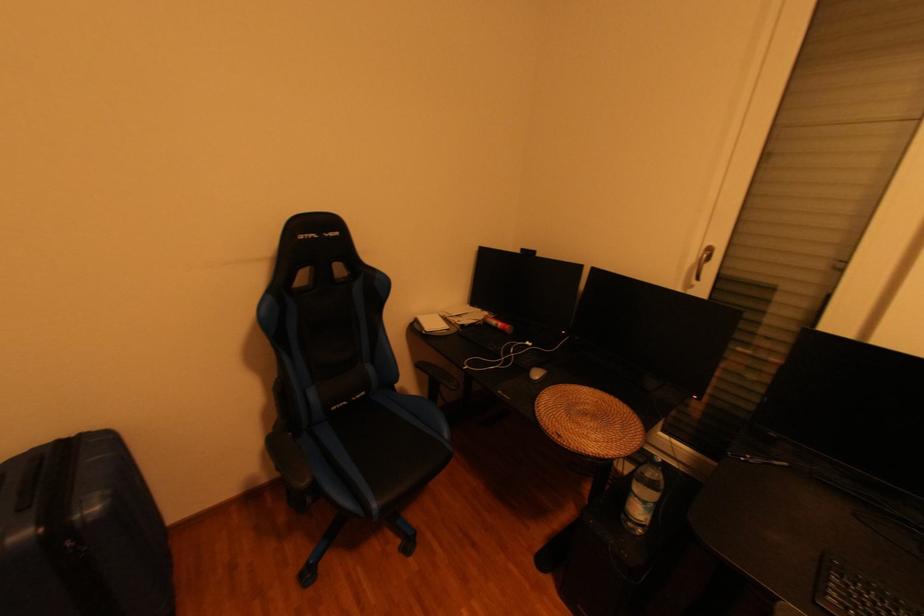
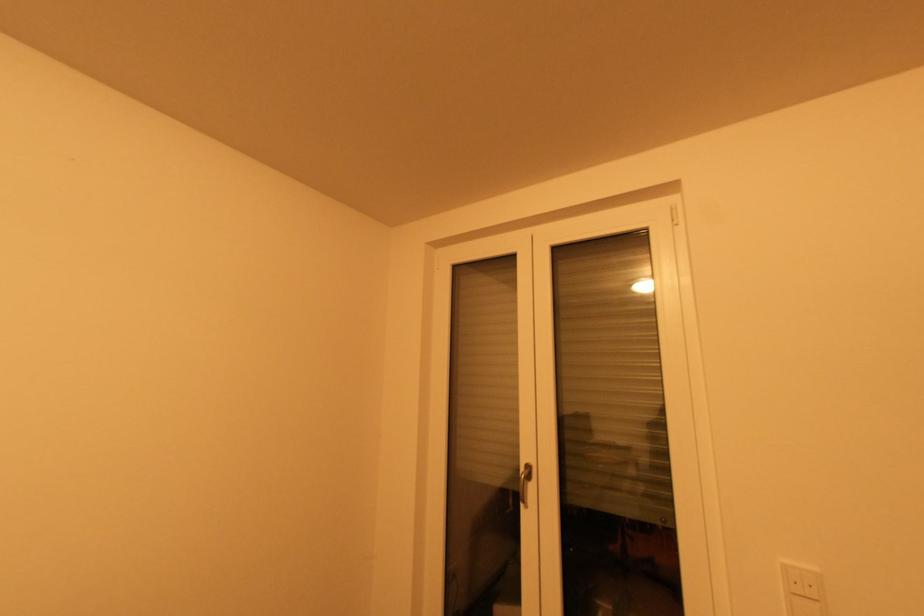
Question: The camera is either moving clockwise (left) or counter-clockwise (right) around the object. The first image is from the beginning of the video and the second image is from the end. Is the camera moving left or right when shooting the video?

Choices:
 (A) Left
 (B) Right

Answer: (A)